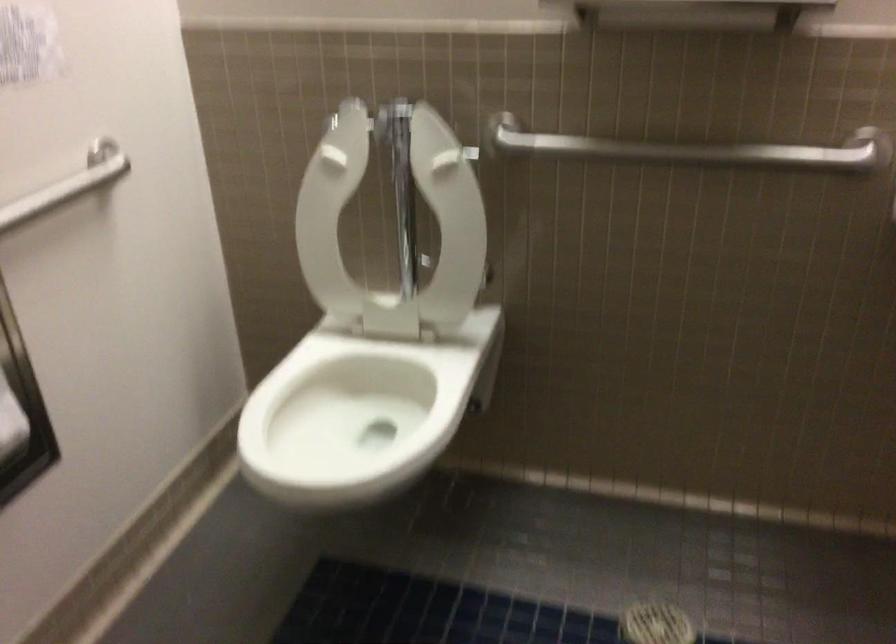
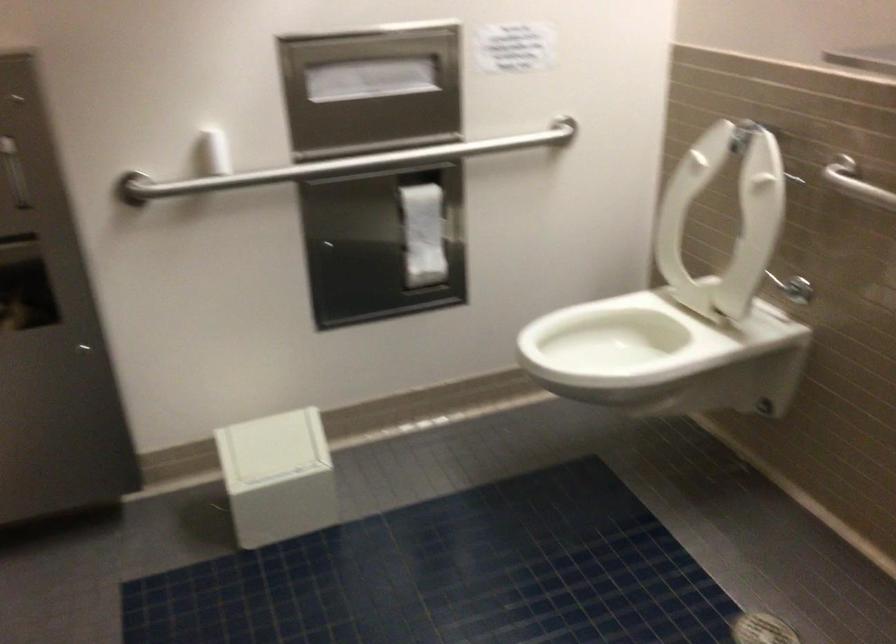
Where in the second image is the point corresponding to point (561, 138) from the first image?

(856, 183)